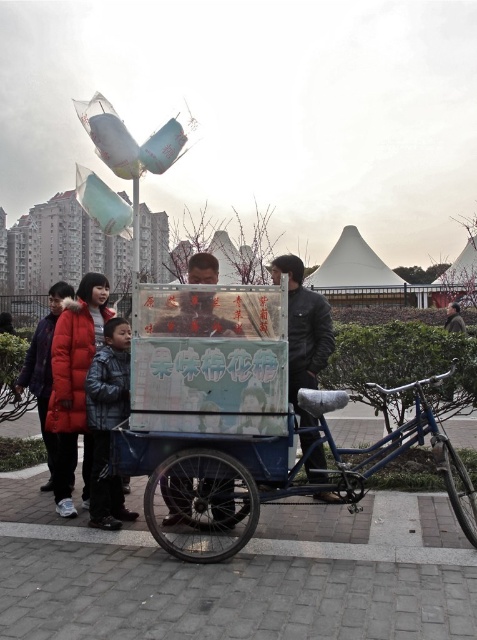
Does blue metallic bicycle at center have a smaller size compared to dark gray jacket at lower left?

Actually, blue metallic bicycle at center might be larger than dark gray jacket at lower left.

The width and height of the screenshot is (477, 640). What do you see at coordinates (207, 481) in the screenshot?
I see `blue metallic bicycle at center` at bounding box center [207, 481].

Where is `blue metallic bicycle at center`? blue metallic bicycle at center is located at coordinates (207, 481).

Is blue metallic bicycle at center wider than metallic cart at center?

Yes, blue metallic bicycle at center is wider than metallic cart at center.

Does point (176, 547) come in front of point (184, 333)?

Yes, it is.

Which is behind, point (226, 496) or point (189, 326)?

Point (189, 326)

Locate an element on the screen. blue metallic bicycle at center is located at coordinates (207, 481).

Is black leather jacket at center further to the viewer compared to metallic cart at center?

Yes, black leather jacket at center is further from the viewer.

Is point (327, 317) closer to viewer compared to point (188, 282)?

Yes.

Find the location of a particular element. This screenshot has width=477, height=640. black leather jacket at center is located at coordinates (303, 330).